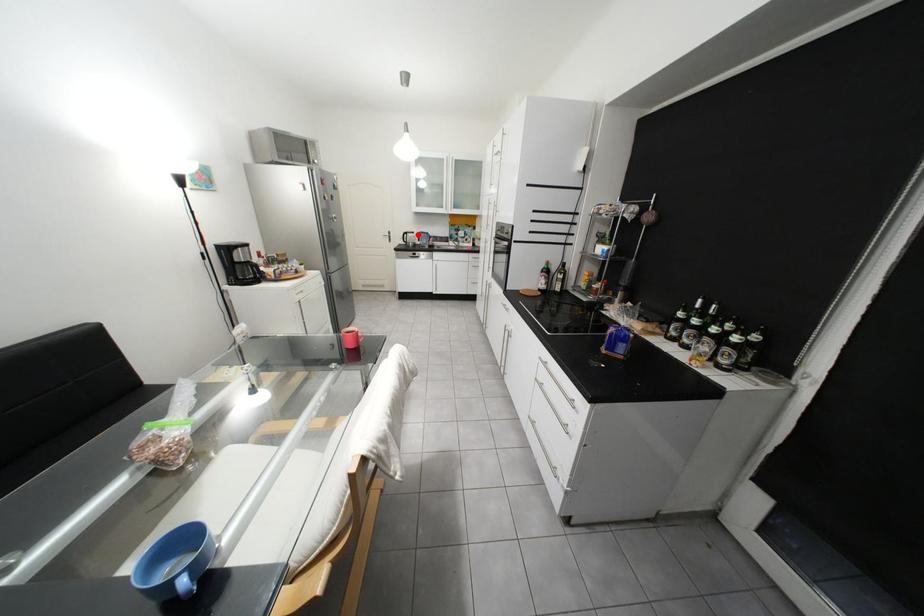
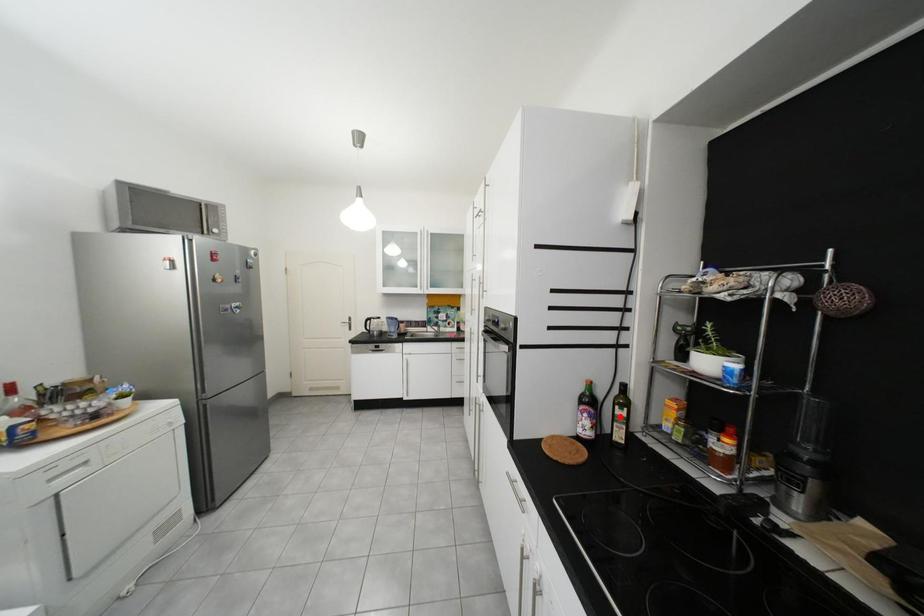
I am providing you with two images of the same scene from different viewpoints. A red point is marked on the first image and another point is marked on the second image. Is the marked point in image1 the same physical position as the marked point in image2?

No